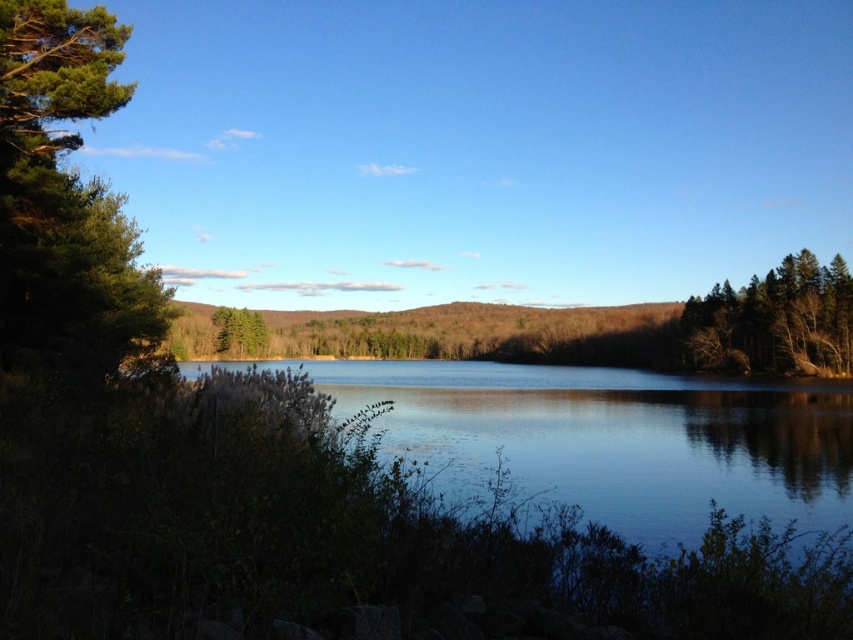
You are a photographer planning to capture the reflection of the green matte tree at right in the clear water at center. Based on their relative heights, can you confirm if the tree will be fully visible in the reflection?

The clear water at center is not as tall as the green matte tree at right, so the reflection of the tree may not fully show the entire tree in the water since the water area is shorter than the tree.